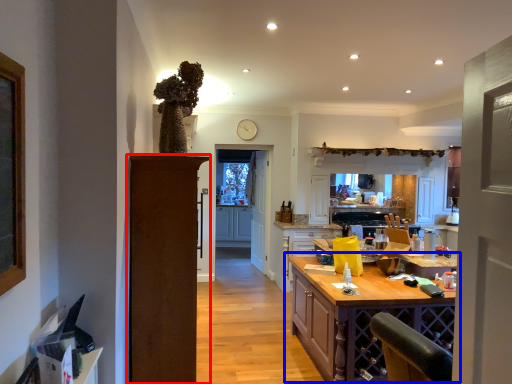
Question: Which of the following is the farthest to the observer, door (highlighted by a red box) or table (highlighted by a blue box)?

Choices:
 (A) door
 (B) table

Answer: (B)